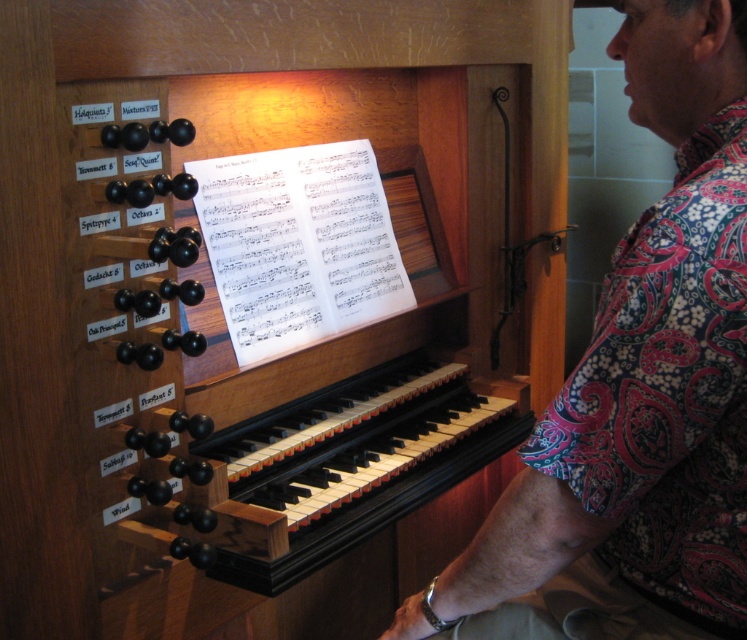
Question: Which object is closer to the camera taking this photo?

Choices:
 (A) floral fabric shirt at right
 (B) black polished wood keyboard at center

Answer: (A)

Question: Does floral fabric shirt at right appear on the right side of black polished wood keyboard at center?

Choices:
 (A) no
 (B) yes

Answer: (B)

Question: Among these objects, which one is farthest from the camera?

Choices:
 (A) black polished wood keyboard at center
 (B) floral fabric shirt at right

Answer: (A)

Question: Which object appears closest to the camera in this image?

Choices:
 (A) floral fabric shirt at right
 (B) black polished wood keyboard at center

Answer: (A)

Question: Is floral fabric shirt at right above black polished wood keyboard at center?

Choices:
 (A) yes
 (B) no

Answer: (A)

Question: Can you confirm if floral fabric shirt at right is thinner than black polished wood keyboard at center?

Choices:
 (A) no
 (B) yes

Answer: (B)